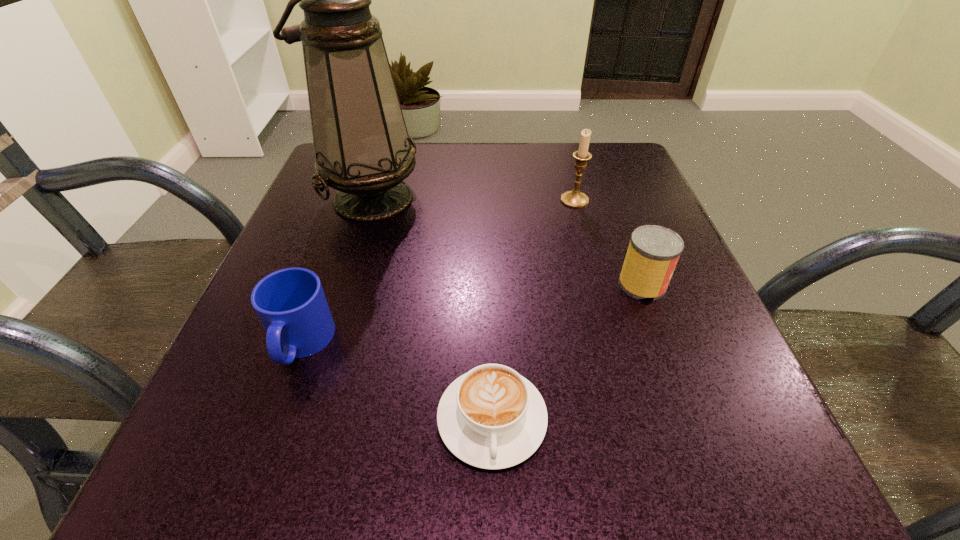
Where is `vacant space located 0.310m on the back of the rightmost object`? Image resolution: width=960 pixels, height=540 pixels. vacant space located 0.310m on the back of the rightmost object is located at coordinates (602, 177).

Where is `free region located on the side with the handle of the mug`? The width and height of the screenshot is (960, 540). free region located on the side with the handle of the mug is located at coordinates (262, 450).

I want to click on oil lamp at the far edge, so click(362, 148).

Identify the location of candle holder at the far edge. (575, 199).

Locate an element on the screen. object present at the near edge is located at coordinates (491, 417).

Locate an element on the screen. Image resolution: width=960 pixels, height=540 pixels. oil lamp at the left edge is located at coordinates (362, 148).

The height and width of the screenshot is (540, 960). In order to click on mug located in the left edge section of the desktop in this screenshot , I will do `click(290, 303)`.

This screenshot has height=540, width=960. What are the coordinates of `candle holder positioned at the right edge` in the screenshot? It's located at (575, 199).

I want to click on can situated at the right edge, so (653, 252).

Identify the location of object at the far left corner. click(362, 148).